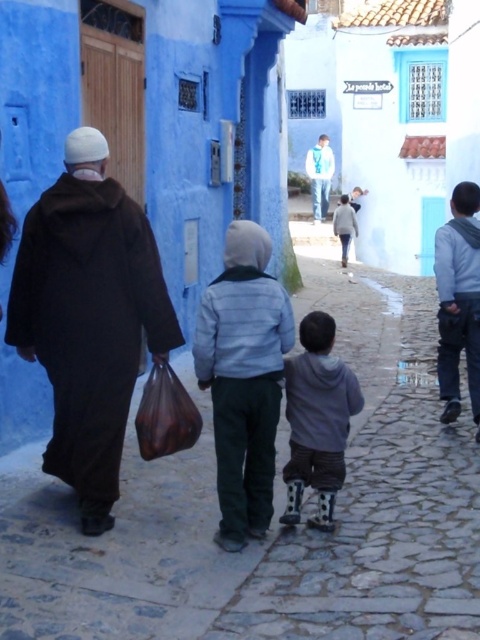
Does light blue striped jacket at center have a lesser width compared to brown leather bag at lower left?

Indeed, light blue striped jacket at center has a lesser width compared to brown leather bag at lower left.

Is point (257, 497) less distant than point (66, 180)?

No, (257, 497) is behind (66, 180).

This screenshot has width=480, height=640. Identify the location of light blue striped jacket at center. 243,378.

Can you confirm if dark brown woolen robe at left is thinner than light blue striped jacket at center?

Incorrect, dark brown woolen robe at left's width is not less than light blue striped jacket at center's.

Measure the distance between dark brown woolen robe at left and camera.

The distance of dark brown woolen robe at left from camera is 4.11 meters.

Is point (155, 266) closer to viewer compared to point (291, 310)?

Yes.

You are a GUI agent. You are given a task and a screenshot of the screen. Output one action in this format:
    pyautogui.click(x=<x>, y=<y>)
    Task: Click on the dark brown woolen robe at left
    
    Given the screenshot: What is the action you would take?
    pyautogui.click(x=88, y=317)

Is point (323, 212) less distant than point (343, 252)?

That is False.

Between white matte jacket at center and light gray fabric robe at center, which one appears on the right side from the viewer's perspective?

Positioned to the right is light gray fabric robe at center.

Which is in front, point (316, 188) or point (333, 224)?

Point (333, 224) is more forward.

Where is `white matte jacket at center`? white matte jacket at center is located at coordinates (320, 176).